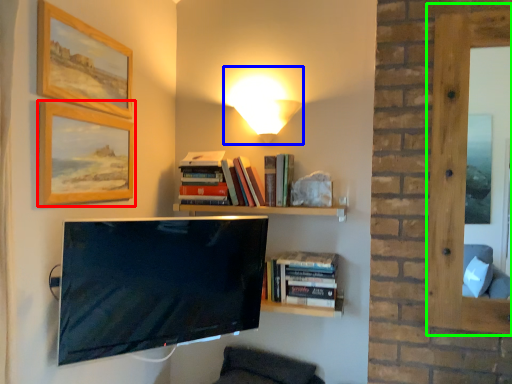
Question: Which object is positioned farthest from picture frame (highlighted by a red box)? Select from table lamp (highlighted by a blue box) and window (highlighted by a green box).

Choices:
 (A) table lamp
 (B) window

Answer: (B)